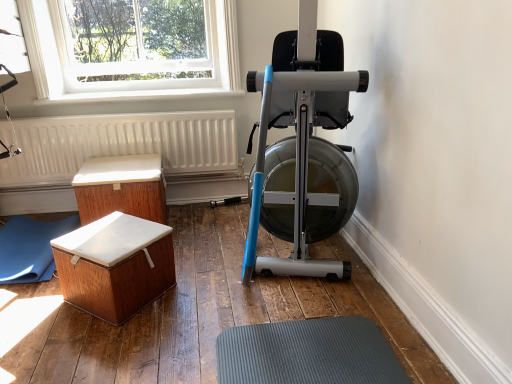
Question: Considering the positions of white wood chest at lower left, placed as the 2th furniture when sorted from front to back, and wooden chest at lower left, which ranks as the 1th furniture in front-to-back order, in the image, is white wood chest at lower left, placed as the 2th furniture when sorted from front to back, wider or thinner than wooden chest at lower left, which ranks as the 1th furniture in front-to-back order,?

Choices:
 (A) wide
 (B) thin

Answer: (A)

Question: Is white wood chest at lower left, positioned as the 1th furniture in back-to-front order, to the left or to the right of wooden chest at lower left, which ranks as the 1th furniture in front-to-back order, in the image?

Choices:
 (A) right
 (B) left

Answer: (B)

Question: Estimate the real-world distances between objects in this image. Which object is farther from the clear glass window at upper left?

Choices:
 (A) wooden chest at lower left, which ranks as the 1th furniture in front-to-back order
 (B) silver metallic stationary bicycle at center
 (C) white wood chest at lower left, placed as the 2th furniture when sorted from front to back
 (D) white textured radiator at lower left
 (E) blue rubber yoga mat at lower left

Answer: (A)

Question: Which object is the farthest from the white wood chest at lower left, placed as the 2th furniture when sorted from front to back?

Choices:
 (A) silver metallic stationary bicycle at center
 (B) blue rubber yoga mat at lower left
 (C) clear glass window at upper left
 (D) white textured radiator at lower left
 (E) wooden chest at lower left, marked as the 2th furniture in a back-to-front arrangement

Answer: (A)